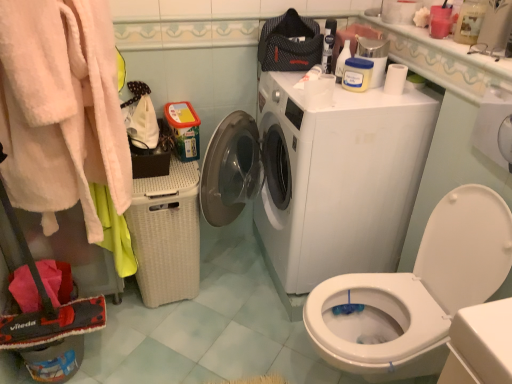
The width and height of the screenshot is (512, 384). I want to click on free space in front of white wicker laundry basket at left, so click(x=168, y=340).